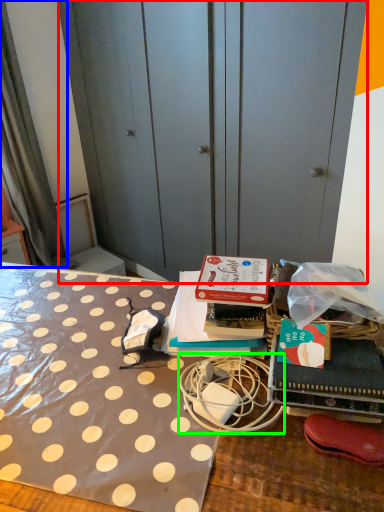
Question: Which object is positioned farthest from dresser (highlighted by a red box)? Select from curtain (highlighted by a blue box) and twin (highlighted by a green box).

Choices:
 (A) curtain
 (B) twin

Answer: (B)